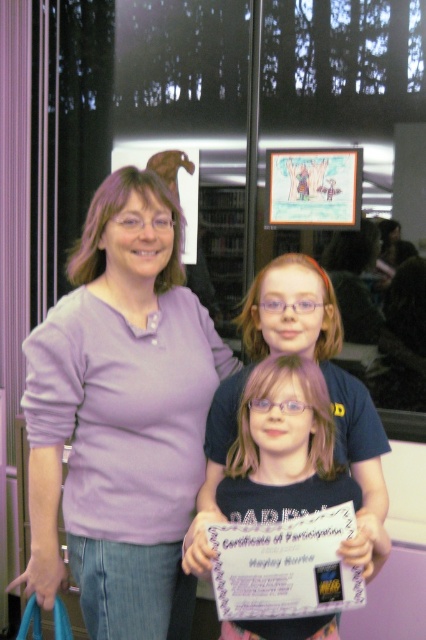
You are standing in the library and see the purple cotton shirt at center. Can you tell me where exactly it is positioned in the room relative to the large windows with reflections of trees?

The purple cotton shirt at center is located at point 0.652 on the horizontal axis and 0.284 on the vertical axis, which places it closer to the right side of the room and slightly above the center vertically, near the large windows with tree reflections.

You are a photographer trying to capture a group photo of the purple cotton shirt at center and the matte black shirt at center. Since you want to frame them properly, which one should you place on the left side of your camera frame?

The purple cotton shirt at center should be placed on the left side of your camera frame because it is already positioned on the left side of the matte black shirt at center in the original image.